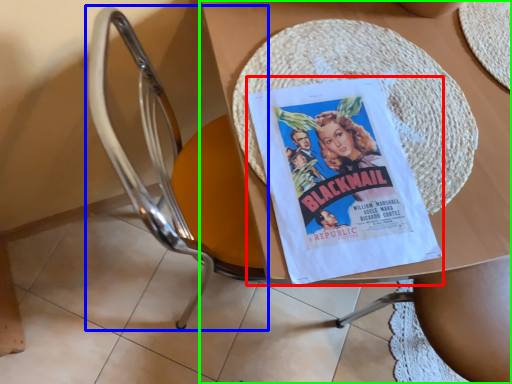
Question: Considering the real-world distances, which object is farthest from comic book (highlighted by a red box)? chair (highlighted by a blue box) or table (highlighted by a green box)?

Choices:
 (A) chair
 (B) table

Answer: (A)